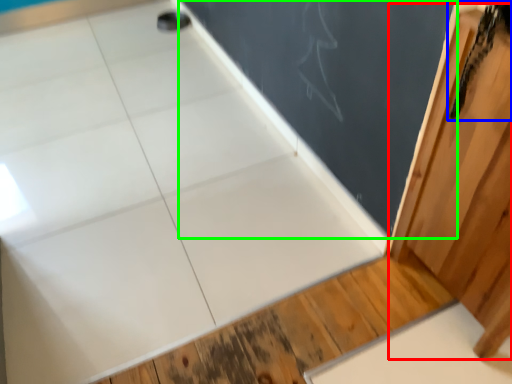
Question: Which is nearer to the barn door (highlighted by a red box)? animal (highlighted by a blue box) or bulletin board (highlighted by a green box).

Choices:
 (A) animal
 (B) bulletin board

Answer: (A)